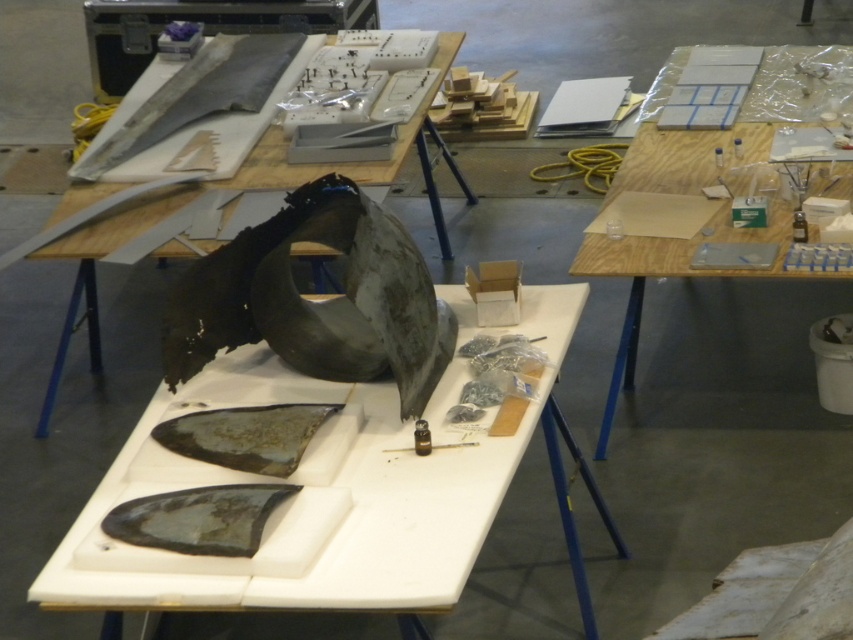
You are setting up a display in a museum and need to arrange the wooden table at center and the rusty metallic fish at center. According to the scene description, which object should be placed to the left when viewed from the front?

The rusty metallic fish at center should be placed to the left because the wooden table at center is to its right as per the scene description.

You are standing at the workbench and want to retrieve an object that is closer to you. Which point should you move towards, point (117, 225) or point (138, 518)?

You should move towards point (138, 518) because it is closer to you than point (117, 225), which is further away.

You are standing in the workspace and want to reach the wooden table at center to retrieve a tool. If your maximum comfortable reaching distance is 3 meters, can you comfortably reach it without moving closer?

The wooden table at center is 3.62 meters away from the camera, which is beyond your maximum comfortable reaching distance of 3 meters. You would need to move closer to comfortably reach it.